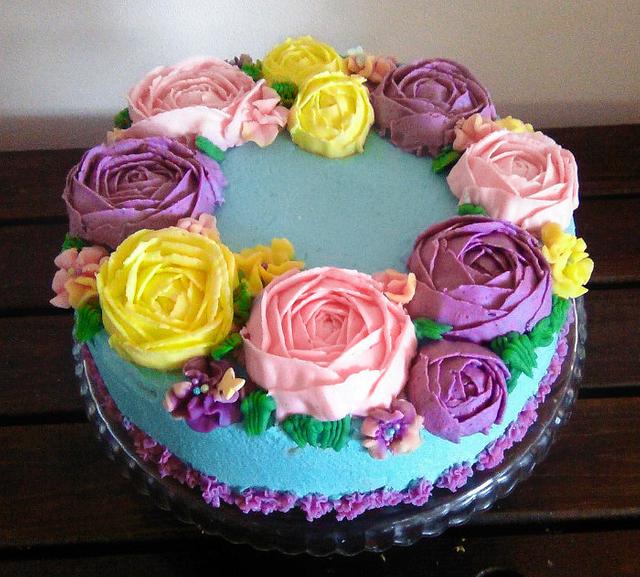
Where is `wall`? wall is located at coordinates (433, 25).